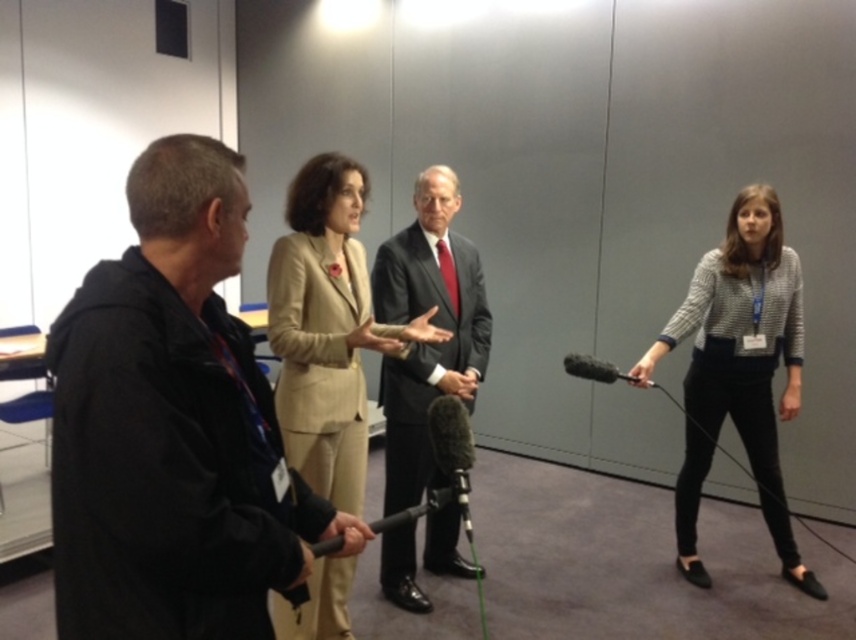
Identify the location of knit sweater at right. (738, 369).

Is knit sweater at right shorter than dark gray suit at center?

Indeed, knit sweater at right has a lesser height compared to dark gray suit at center.

Who is more distant from viewer, (712, 346) or (395, 289)?

The point (712, 346) is behind.

The image size is (856, 640). Identify the location of knit sweater at right. (738, 369).

Is dark gray suit at center smaller than black matte microphone at center?

No, dark gray suit at center is not smaller than black matte microphone at center.

Is dark gray suit at center taller than black matte microphone at center?

Yes.

Where is `dark gray suit at center`? The image size is (856, 640). dark gray suit at center is located at coordinates (432, 323).

Does knit sweater at right lie in front of black matte microphone at center?

No, it is behind black matte microphone at center.

Is point (747, 269) more distant than point (465, 412)?

That is True.

The width and height of the screenshot is (856, 640). I want to click on knit sweater at right, so click(x=738, y=369).